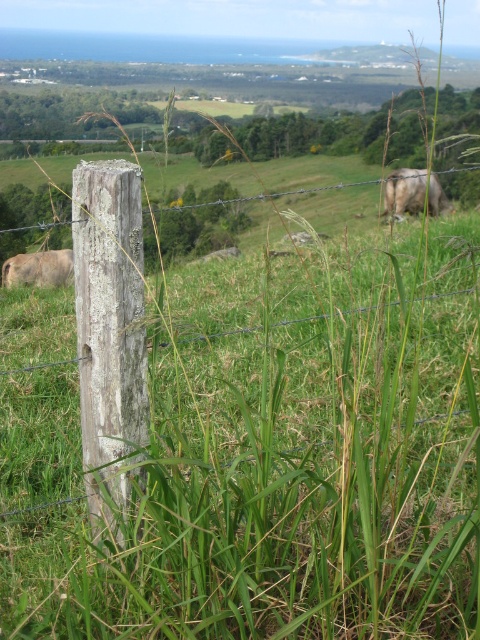
Question: Does white woolly cow at upper right lie in front of brown matte cow at left?

Choices:
 (A) no
 (B) yes

Answer: (A)

Question: Is white woolly cow at upper right thinner than brown matte cow at left?

Choices:
 (A) yes
 (B) no

Answer: (B)

Question: Does white woolly cow at upper right have a lesser width compared to brown matte cow at left?

Choices:
 (A) no
 (B) yes

Answer: (A)